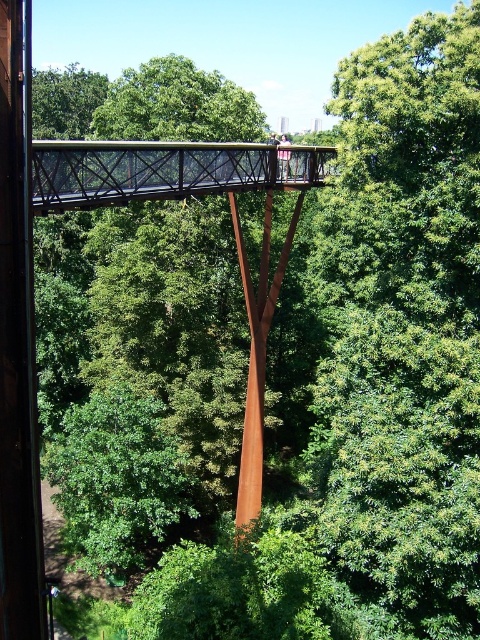
You are standing at the origin point of the coordinate system in the forest. You want to reach the rustic metal bridge at center. According to the coordinate system, in which direction should you move to reach it?

The rustic metal bridge at center is located at coordinate point (x=165, y=170), so you should move northeast to reach it.

You are a hiker standing on the rustic metal bridge at center and want to reach the rusty metal pole at center. Which direction should you move to get closer to the pole?

The rustic metal bridge at center is positioned on the left side of the rusty metal pole at center, so you should move to the right to get closer to the pole.